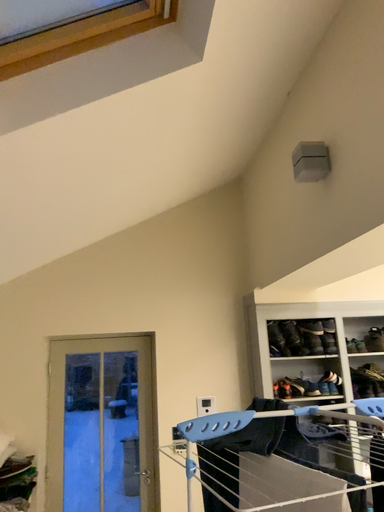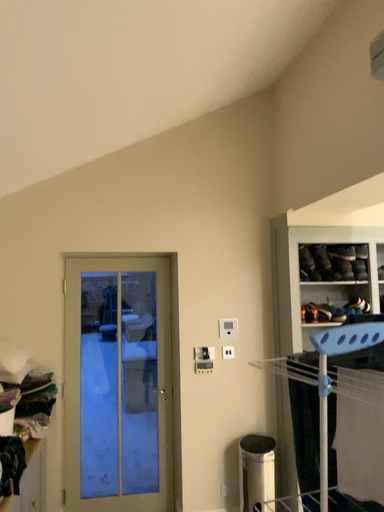
Question: Which way did the camera rotate in the video?

Choices:
 (A) rotated downward
 (B) rotated upward

Answer: (A)